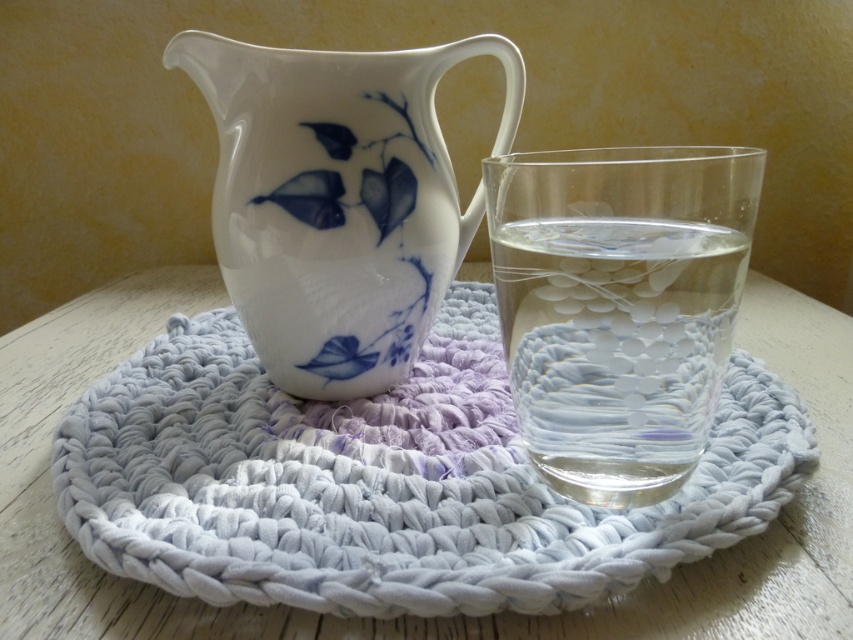
You are setting up a small table for a tea party. You have a white knitted coaster at center and a white porcelain jug at center. Which object should you place first if you want to ensure there is enough space for both items on the table?

You should place the white porcelain jug at center first because the white knitted coaster at center is larger in size and needs more space, so placing the smaller jug first allows room for the larger coaster afterward.